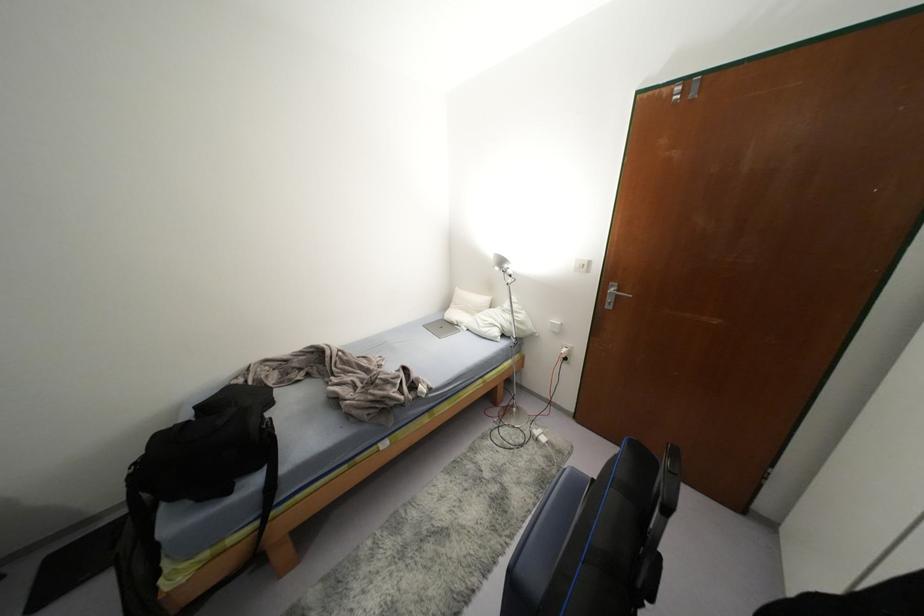
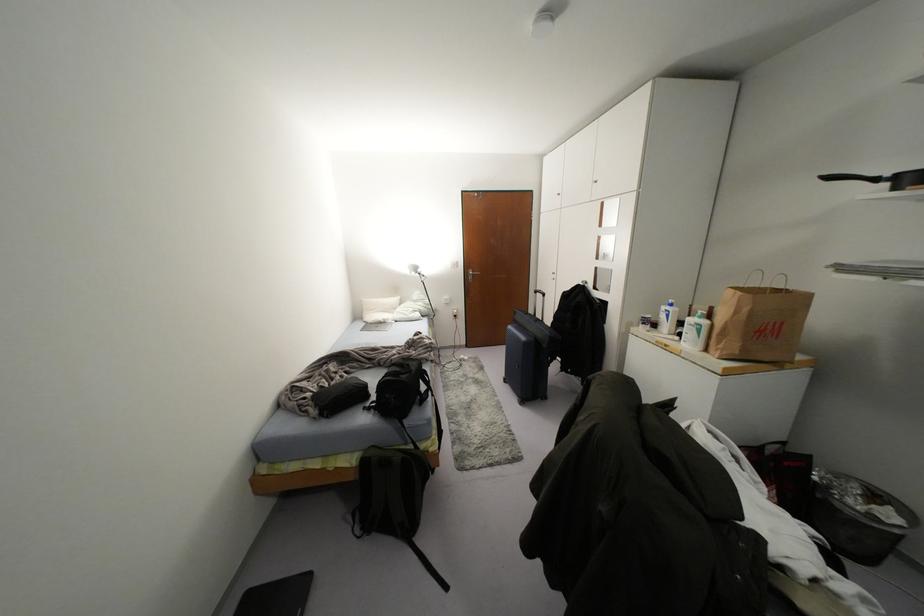
Locate, in the second image, the point that corresponds to pixel 505 265 in the first image.

(419, 270)